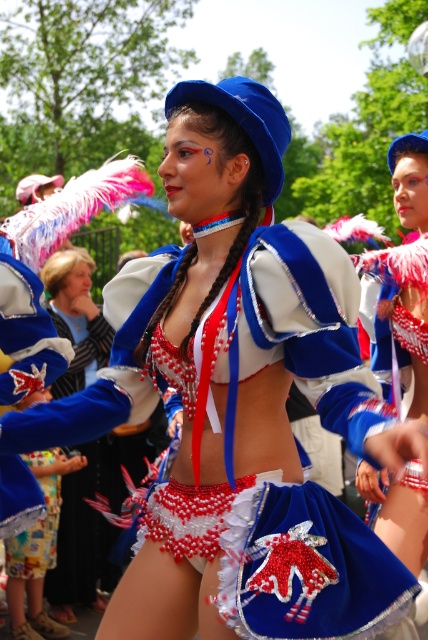
Question: Can you confirm if velvet blue skirt at center is positioned to the left of velvet blue shorts at center?

Choices:
 (A) yes
 (B) no

Answer: (B)

Question: Is velvet blue skirt at center to the right of velvet blue shorts at center from the viewer's perspective?

Choices:
 (A) no
 (B) yes

Answer: (B)

Question: Which of the following is the farthest from the observer?

Choices:
 (A) velvet blue skirt at center
 (B) velvet blue shorts at center

Answer: (B)

Question: Is velvet blue skirt at center to the left of velvet blue shorts at center from the viewer's perspective?

Choices:
 (A) no
 (B) yes

Answer: (A)

Question: Which object appears farthest from the camera in this image?

Choices:
 (A) velvet blue skirt at center
 (B) velvet blue shorts at center

Answer: (B)